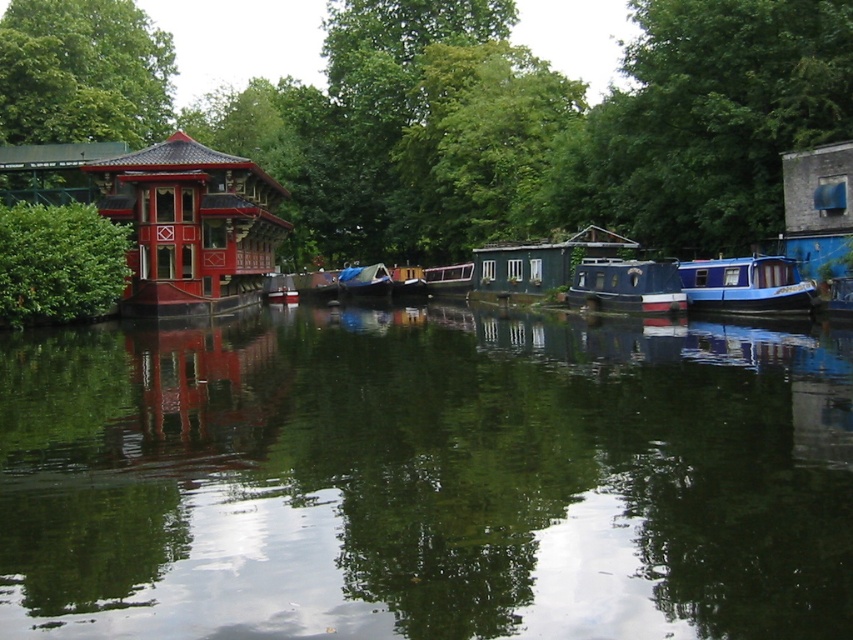
You are standing at the center of the image. Which direction should you walk to reach the shiny lacquered gazebo at left?

You should walk to the left to reach the shiny lacquered gazebo at left since it is located at the left side of the image.

You are a tourist standing on the canal bank and want to take a photo of both the shiny lacquered gazebo at left and the blue glossy houseboat at center. Which object should you adjust your camera angle upwards to capture properly?

You should adjust your camera angle upwards to capture the shiny lacquered gazebo at left because it has a greater height compared to the blue glossy houseboat at center.